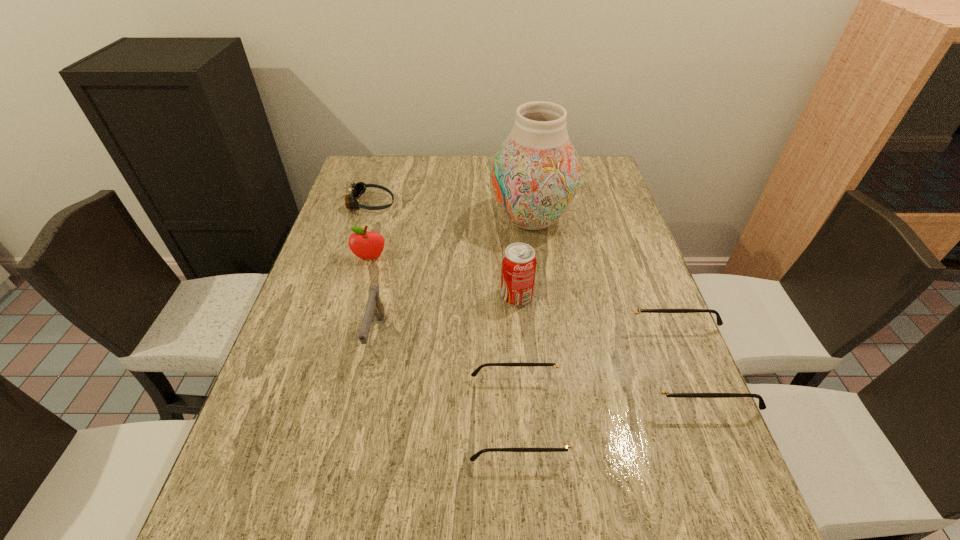
Identify the location of vacant area that lies between the pistol and the goggles. (373, 269).

Identify the location of free space between the shorter spectacles and the fourth farthest object. (517, 357).

You are a GUI agent. You are given a task and a screenshot of the screen. Output one action in this format:
    pyautogui.click(x=<x>, y=<y>)
    Task: Click on the object that is the second closest to the taller spectacles
    This screenshot has width=960, height=540.
    Given the screenshot: What is the action you would take?
    pyautogui.click(x=519, y=260)

The height and width of the screenshot is (540, 960). Identify the location of object that is the third closest one to the fifth nearest object. (535, 174).

Locate an element on the screen. Image resolution: width=960 pixels, height=540 pixels. free space that satisfies the following two spatial constraints: 1. on the back side of the apple; 2. on the right side of the vase is located at coordinates (381, 219).